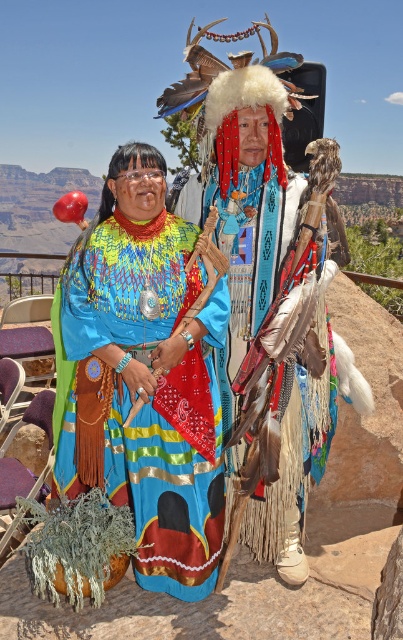
Is matte blue fabric dress at center below multicolored woven dress at center?

Incorrect, matte blue fabric dress at center is not positioned below multicolored woven dress at center.

Can you confirm if matte blue fabric dress at center is positioned to the left of multicolored woven dress at center?

Incorrect, matte blue fabric dress at center is not on the left side of multicolored woven dress at center.

Between point (147, 502) and point (66, 326), which one is positioned behind?

The point (147, 502) is behind.

Where is `matte blue fabric dress at center`? matte blue fabric dress at center is located at coordinates (205, 339).

Can you confirm if multicolored woven dress at center is smaller than multicolored woven fabric at center?

Correct, multicolored woven dress at center occupies less space than multicolored woven fabric at center.

Can you confirm if multicolored woven dress at center is taller than multicolored woven fabric at center?

No, multicolored woven dress at center is not taller than multicolored woven fabric at center.

Does point (193, 518) come farther from viewer compared to point (282, 205)?

No, (193, 518) is closer to viewer.

Identify the location of multicolored woven dress at center. pos(174,467).

What do you see at coordinates (205, 339) in the screenshot?
I see `matte blue fabric dress at center` at bounding box center [205, 339].

Who is positioned more to the left, matte blue fabric dress at center or multicolored woven fabric at center?

From the viewer's perspective, matte blue fabric dress at center appears more on the left side.

Who is more forward, (280, 397) or (338, 227)?

Point (280, 397) is more forward.

At what (x,y) coordinates should I click in order to perform the action: click on matte blue fabric dress at center. Please return your answer as a coordinate pair (x, y). This screenshot has height=640, width=403. Looking at the image, I should click on (205, 339).